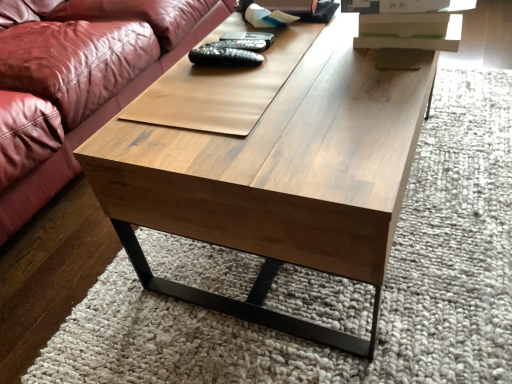
Question: Is black matte remote at center, the 3th remote when ordered from top to bottom, bigger than wooden coffee table at center?

Choices:
 (A) no
 (B) yes

Answer: (A)

Question: From a real-world perspective, is black matte remote at center, positioned as the first remote in bottom-to-top order, beneath wooden coffee table at center?

Choices:
 (A) yes
 (B) no

Answer: (B)

Question: Is black matte remote at center, the 3th remote when ordered from top to bottom, oriented towards wooden coffee table at center?

Choices:
 (A) yes
 (B) no

Answer: (B)

Question: Is black matte remote at center, the 3th remote when ordered from top to bottom, outside of wooden coffee table at center?

Choices:
 (A) yes
 (B) no

Answer: (A)

Question: Does black matte remote at center, positioned as the first remote in bottom-to-top order, have a greater height compared to wooden coffee table at center?

Choices:
 (A) yes
 (B) no

Answer: (B)

Question: Is black matte remote at center, positioned as the second remote in bottom-to-top order, bigger or smaller than black matte remote at center, positioned as the first remote in bottom-to-top order?

Choices:
 (A) big
 (B) small

Answer: (B)

Question: From a real-world perspective, relative to black matte remote at center, the 3th remote when ordered from top to bottom, is black matte remote at center, which ranks as the second remote in top-to-bottom order, vertically above or below?

Choices:
 (A) below
 (B) above

Answer: (A)

Question: From their relative heights in the image, would you say black matte remote at center, positioned as the second remote in bottom-to-top order, is taller or shorter than black matte remote at center, the 3th remote when ordered from top to bottom?

Choices:
 (A) short
 (B) tall

Answer: (A)

Question: Considering the positions of black matte remote at center, which ranks as the second remote in top-to-bottom order, and black matte remote at center, the 3th remote when ordered from top to bottom, in the image, is black matte remote at center, which ranks as the second remote in top-to-bottom order, wider or thinner than black matte remote at center, the 3th remote when ordered from top to bottom,?

Choices:
 (A) wide
 (B) thin

Answer: (A)

Question: Looking at the image, does wooden coffee table at center seem bigger or smaller compared to black matte remote at center, the 3th remote when ordered from top to bottom?

Choices:
 (A) big
 (B) small

Answer: (A)

Question: Would you say wooden coffee table at center is to the left or to the right of black matte remote at center, the 3th remote when ordered from top to bottom, in the picture?

Choices:
 (A) left
 (B) right

Answer: (B)

Question: Does point pyautogui.click(x=320, y=334) appear closer or farther from the camera than point pyautogui.click(x=188, y=56)?

Choices:
 (A) farther
 (B) closer

Answer: (B)

Question: Considering their positions, is wooden coffee table at center located in front of or behind black matte remote at center, positioned as the first remote in bottom-to-top order?

Choices:
 (A) behind
 (B) front

Answer: (B)

Question: From a real-world perspective, is black matte remote at center, the 3th remote when ordered from top to bottom, positioned above or below wooden coffee table at center?

Choices:
 (A) above
 (B) below

Answer: (A)

Question: Is black matte remote at center, positioned as the first remote in bottom-to-top order, spatially inside wooden coffee table at center, or outside of it?

Choices:
 (A) outside
 (B) inside

Answer: (A)